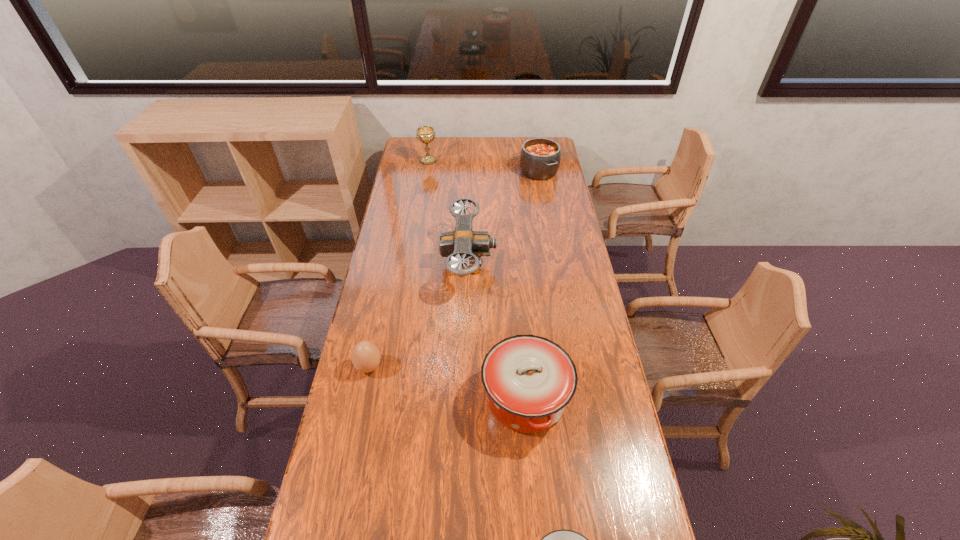
Find the location of a particular element. The image size is (960, 540). chalice is located at coordinates (426, 134).

Identify the location of drone. The width and height of the screenshot is (960, 540). (462, 243).

Where is `the nearer casserole`? This screenshot has height=540, width=960. the nearer casserole is located at coordinates (529, 380).

You are a GUI agent. You are given a task and a screenshot of the screen. Output one action in this format:
    pyautogui.click(x=<x>, y=<y>)
    Task: Click on the third shortest object
    
    Given the screenshot: What is the action you would take?
    pyautogui.click(x=540, y=158)

Find the location of a particular element. Image resolution: width=960 pixels, height=540 pixels. the shorter casserole is located at coordinates (540, 158).

Where is `the fifth tallest object`? This screenshot has height=540, width=960. the fifth tallest object is located at coordinates (365, 356).

At what (x,y) coordinates should I click in order to perform the action: click on vacant region located 0.100m on the right of the chalice. Please return your answer as a coordinate pair (x, y). The height and width of the screenshot is (540, 960). Looking at the image, I should click on (456, 161).

Where is `vacant area located on the front-facing side of the drone`? vacant area located on the front-facing side of the drone is located at coordinates (536, 262).

At what (x,y) coordinates should I click in order to perform the action: click on free location located 0.210m on the back of the taller casserole. Please return your answer as a coordinate pair (x, y). This screenshot has width=960, height=540. Looking at the image, I should click on (518, 309).

In order to click on vacant space located on the left of the shorter casserole in this screenshot , I will do `click(473, 171)`.